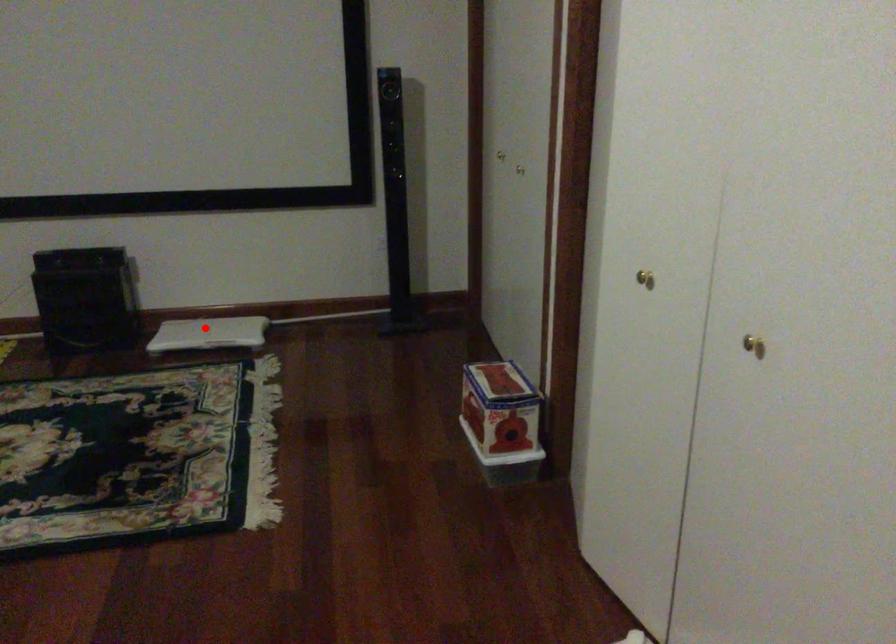
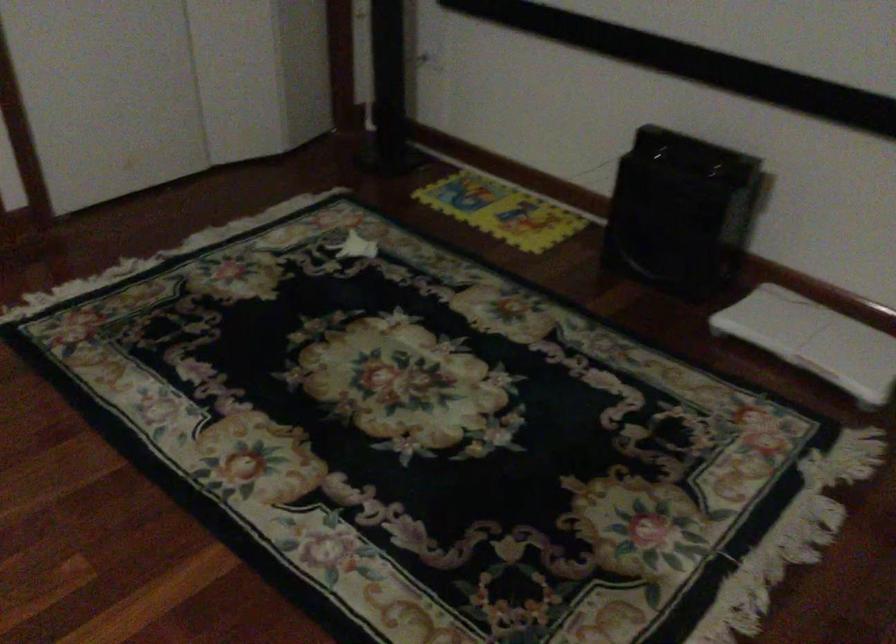
The point at the highlighted location is marked in the first image. Where is the corresponding point in the second image?

(814, 339)